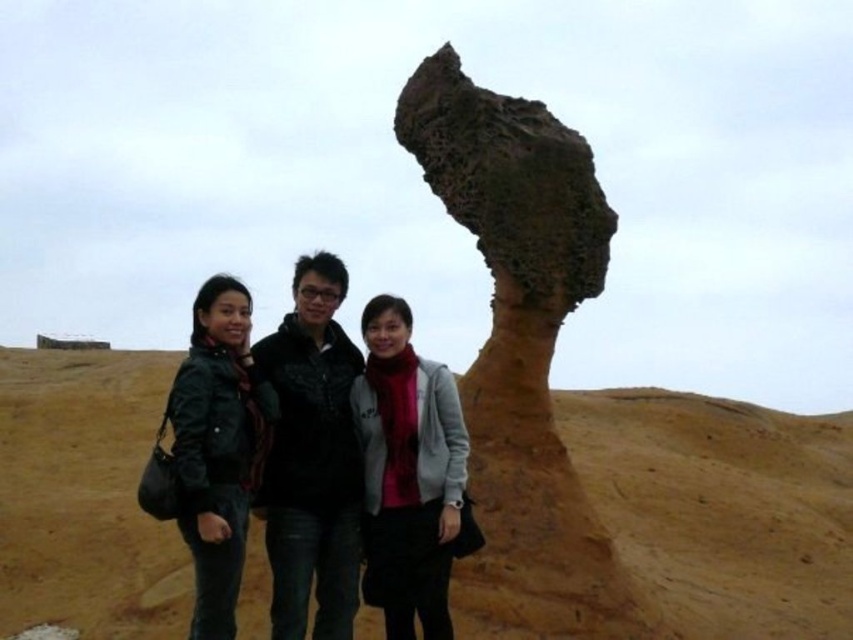
You are a photographer trying to capture a group photo of the three people in front of the rock formation. You notice two jackets labeled as matte black jacket at center and black matte jacket at center. Which jacket appears wider in the photo?

The matte black jacket at center appears wider than the black matte jacket at center in the photo.

Based on the coordinates provided, where is the rusty stone formation at center located in the image?

The rusty stone formation at center is located at the coordinates point (521,349).

What is the location of the point with coordinates (521, 349) in the image?

The point with coordinates (521, 349) is located on the rusty stone formation at center.